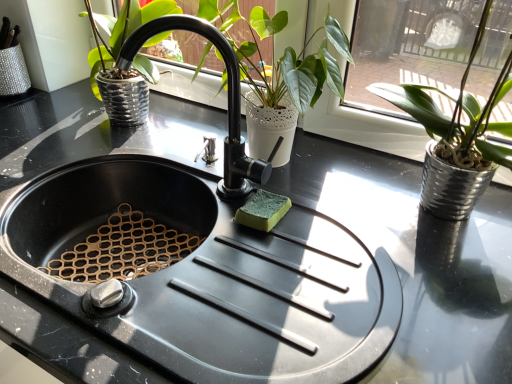
Question: Considering the positions of point (226, 178) and point (242, 57), is point (226, 178) closer or farther from the camera than point (242, 57)?

Choices:
 (A) closer
 (B) farther

Answer: (A)

Question: Considering the positions of black matte faucet at center and white textured pot at center, acting as the 2th houseplant starting from the right, in the image, is black matte faucet at center taller or shorter than white textured pot at center, acting as the 2th houseplant starting from the right,?

Choices:
 (A) tall
 (B) short

Answer: (B)

Question: Based on their relative distances, which object is farther from the silver metallic pot at right, arranged as the 2th houseplant when viewed from the left?

Choices:
 (A) black matte faucet at center
 (B) white textured pot at center, acting as the 2th houseplant starting from the right

Answer: (A)

Question: Which of these objects is positioned closest to the silver metallic pot at right, arranged as the 2th houseplant when viewed from the left?

Choices:
 (A) white textured pot at center, which is the first houseplant in left-to-right order
 (B) black matte faucet at center

Answer: (A)